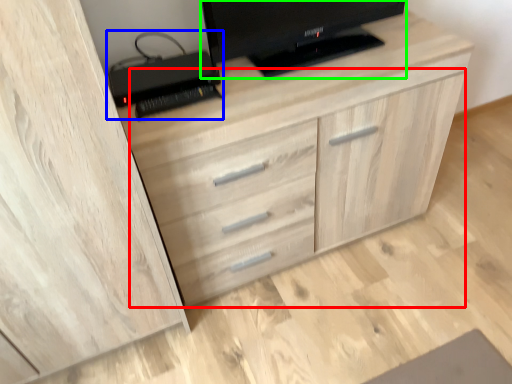
Question: Which object is positioned closest to dresser (highlighted by a red box)? Select from computer (highlighted by a blue box) and television (highlighted by a green box).

Choices:
 (A) computer
 (B) television

Answer: (B)